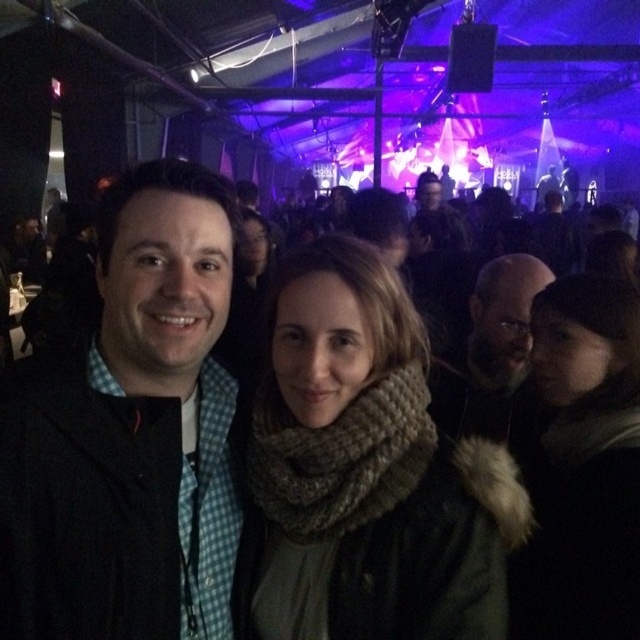
Between point (369, 467) and point (515, 376), which one is positioned behind?

Positioned behind is point (515, 376).

Does knitted beige scarf at center lie in front of dark brown fur coat at right?

Yes, knitted beige scarf at center is in front of dark brown fur coat at right.

Which is in front, point (292, 636) or point (509, 304)?

Point (292, 636) is in front.

The height and width of the screenshot is (640, 640). I want to click on knitted beige scarf at center, so click(x=369, y=468).

Is black checkered shirt at center above knitted beige scarf at center?

Correct, black checkered shirt at center is located above knitted beige scarf at center.

Can you confirm if black checkered shirt at center is positioned to the left of knitted beige scarf at center?

Yes, black checkered shirt at center is to the left of knitted beige scarf at center.

Is point (225, 312) closer to viewer compared to point (323, 452)?

No, (225, 312) is behind (323, 452).

I want to click on black checkered shirt at center, so click(x=131, y=435).

The height and width of the screenshot is (640, 640). Describe the element at coordinates (131, 435) in the screenshot. I see `black checkered shirt at center` at that location.

Consider the image. Is the position of black checkered shirt at center more distant than that of knitted scarf at center?

No, it is in front of knitted scarf at center.

Image resolution: width=640 pixels, height=640 pixels. I want to click on black checkered shirt at center, so click(x=131, y=435).

Locate an element on the screen. The image size is (640, 640). black checkered shirt at center is located at coordinates (131, 435).